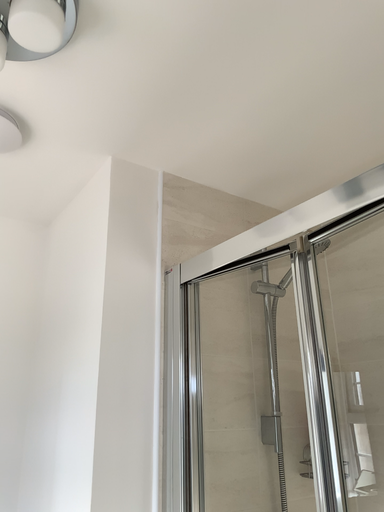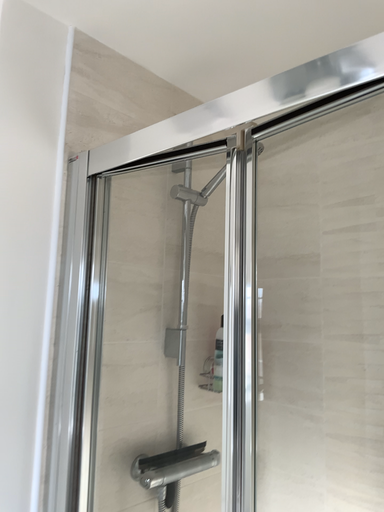
Question: Which way did the camera rotate in the video?

Choices:
 (A) rotated upward
 (B) rotated downward

Answer: (B)